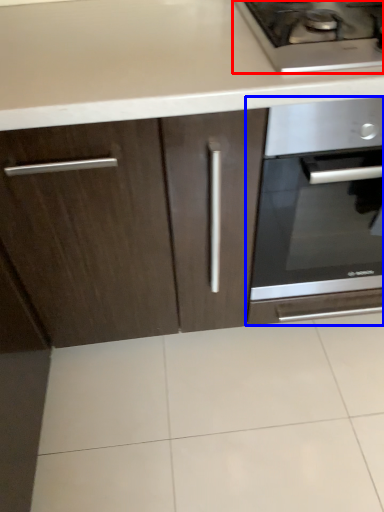
Question: Which of the following is the farthest to the observer, gas stove (highlighted by a red box) or oven (highlighted by a blue box)?

Choices:
 (A) gas stove
 (B) oven

Answer: (B)